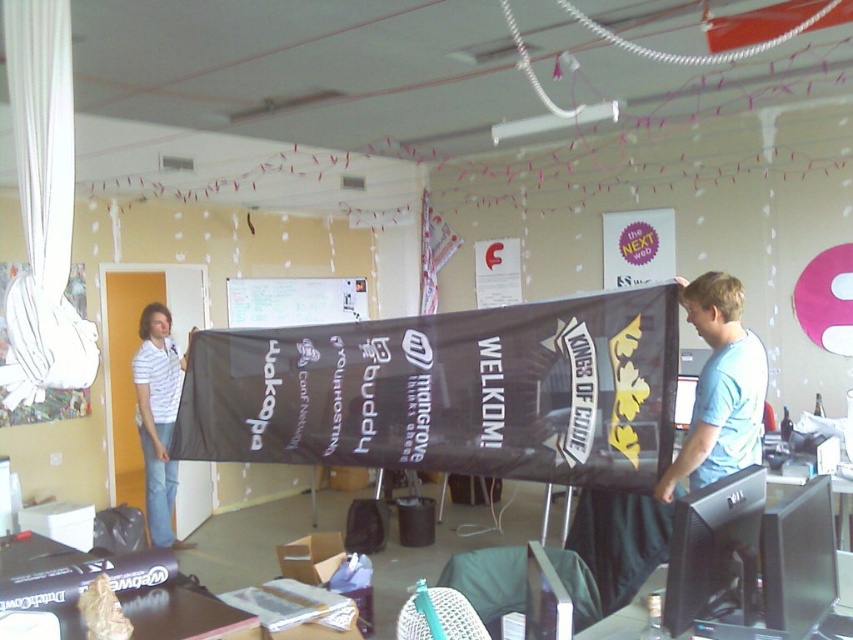
Does point (686, 438) come behind point (677, 634)?

Yes, it is behind point (677, 634).

Does point (712, 300) come farther from viewer compared to point (732, 480)?

Yes, point (712, 300) is farther from viewer.

Locate an element on the screen. This screenshot has width=853, height=640. light blue t-shirt at center is located at coordinates (720, 387).

What are the coordinates of `black fabric banner at center` in the screenshot? It's located at (448, 392).

Who is positioned more to the right, black fabric banner at center or white striped shirt at left?

black fabric banner at center

Which is behind, point (279, 344) or point (157, 332)?

Point (157, 332)

Identify the location of black fabric banner at center. coord(448,392).

Does black glossy monitor at lower right have a smaller size compared to white striped shirt at left?

Correct, black glossy monitor at lower right occupies less space than white striped shirt at left.

Describe the element at coordinates (715, 552) in the screenshot. I see `black glossy monitor at lower right` at that location.

Where is `black glossy monitor at lower right`? This screenshot has height=640, width=853. black glossy monitor at lower right is located at coordinates (715, 552).